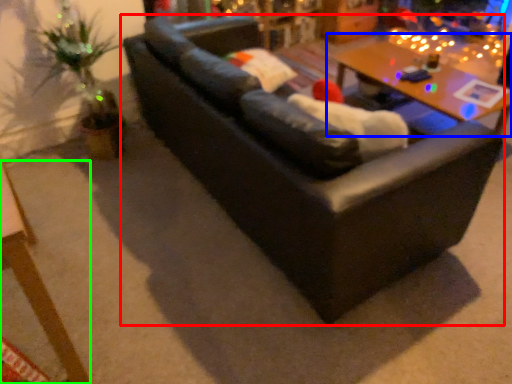
Question: Which object is positioned closest to studio couch (highlighted by a red box)? Select from table (highlighted by a blue box) and table (highlighted by a green box).

Choices:
 (A) table
 (B) table

Answer: (B)